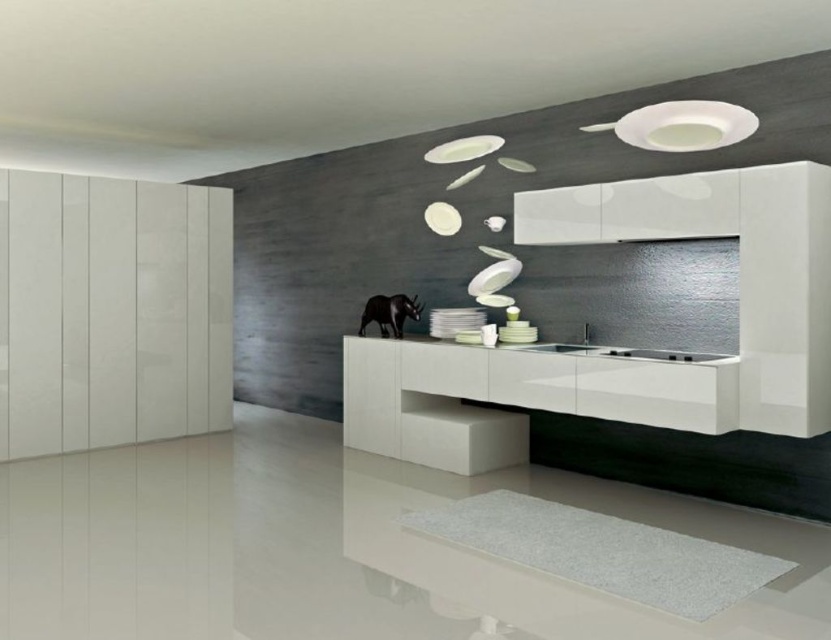
From the picture: You are a chef preparing to wash dishes and need to reach the sink. You are standing at the white matte stool at center. Which direction should you move to reach the white glossy sink at center?

The white matte stool at center is positioned under the white glossy sink at center, so you should move upward to reach the white glossy sink at center.

Based on the photo, you are standing in the kitchen and need to place a decorative item on top of the glossy white vanity at center. However, you also have a small plant that needs to be placed at the same height as the white matte stool at center. Can you determine which object you should place the plant next to to ensure it sits at the correct height?

The glossy white vanity at center is taller than the white matte stool at center. Therefore, placing the plant next to the white matte stool at center will ensure it sits at the correct height.

You are a home decorator planning to place a tall decorative vase in the kitchen. The vase is 1.2 meters in height. Looking at the glossy white vanity at center and the white glossy sink at center, which object would the vase be taller than?

The glossy white vanity at center is much taller than the white glossy sink at center. Since the vase is 1.2 meters tall, it would be taller than the white glossy sink at center but shorter than the glossy white vanity at center.